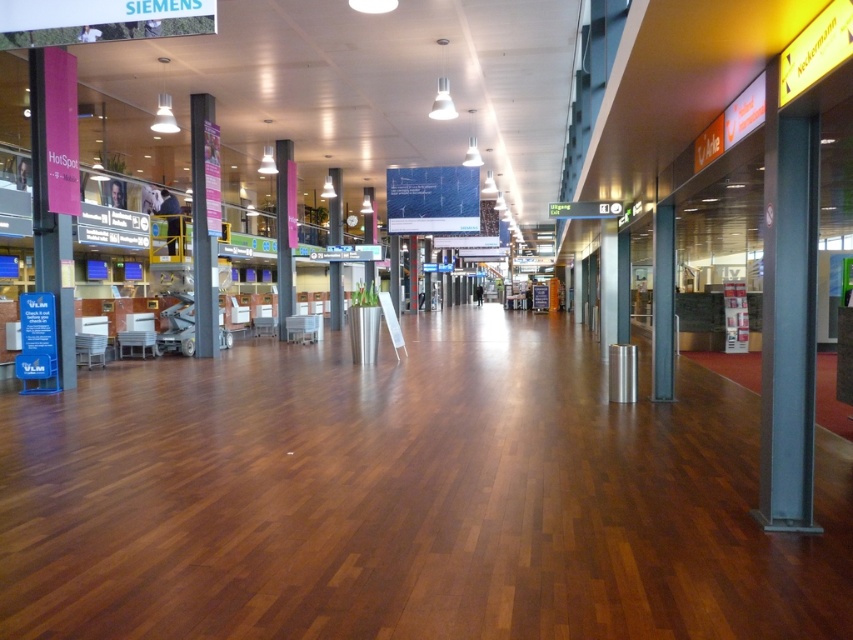
You are standing in the terminal and want to reach the point marked as point (201, 109). If your walking speed is 1.5 meters per second, how many seconds will it take you to reach that point?

The distance of point (201, 109) from viewer is 14.69 meters. At a speed of 1.5 meters per second, it will take approximately 9.8 seconds to reach the point.